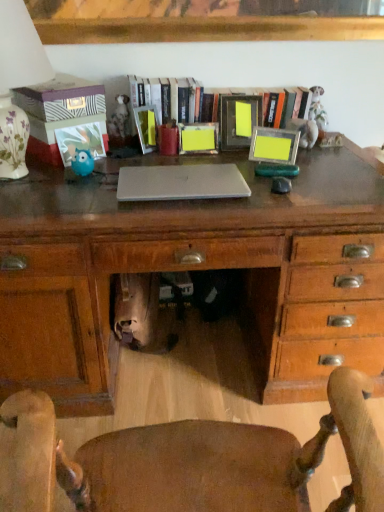
Question: Considering the positions of matte blue owl at left, marked as the 5th picture frame in a right-to-left arrangement, and wooden chair at center in the image, is matte blue owl at left, marked as the 5th picture frame in a right-to-left arrangement, bigger or smaller than wooden chair at center?

Choices:
 (A) small
 (B) big

Answer: (A)

Question: Does point (92, 147) appear closer or farther from the camera than point (215, 428)?

Choices:
 (A) closer
 (B) farther

Answer: (B)

Question: Which of these objects is positioned closest to the wooden frame at center?

Choices:
 (A) matte blue owl at left, marked as the 5th picture frame in a right-to-left arrangement
 (B) matte plastic picture frame at upper center, arranged as the second picture frame when viewed from the left
 (C) wooden chair at center
 (D) satin silver laptop at center
 (E) metallic silver picture frame at center, the 4th picture frame from the left

Answer: (E)

Question: Which is farther from the metallic silver picture frame at center, which ranks as the first picture frame in right-to-left order?

Choices:
 (A) yellow matte picture frame at center, which appears as the third picture frame when viewed from the right
 (B) porcelain floral table lamp at upper left
 (C) satin silver laptop at center
 (D) metallic silver picture frame at center, the 4th picture frame from the left
 (E) wooden chair at center

Answer: (E)